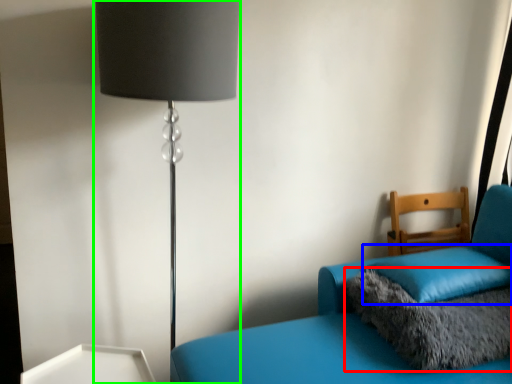
Question: Which object is positioned closest to pillow (highlighted by a red box)? Select from pillow (highlighted by a blue box) and lamp (highlighted by a green box).

Choices:
 (A) pillow
 (B) lamp

Answer: (A)